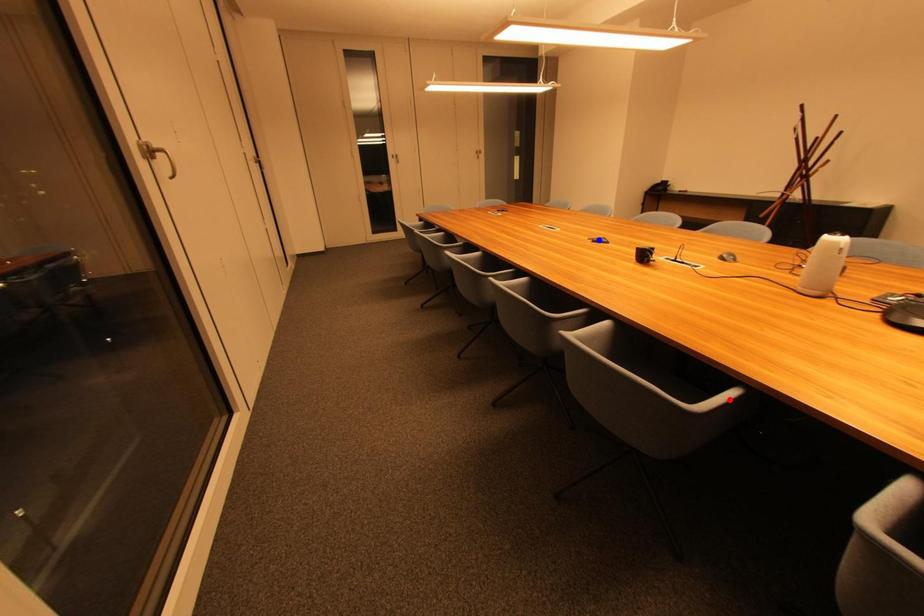
Question: Which of the two points in the image is closer to the camera?

Choices:
 (A) Blue point is closer.
 (B) Red point is closer.

Answer: (B)